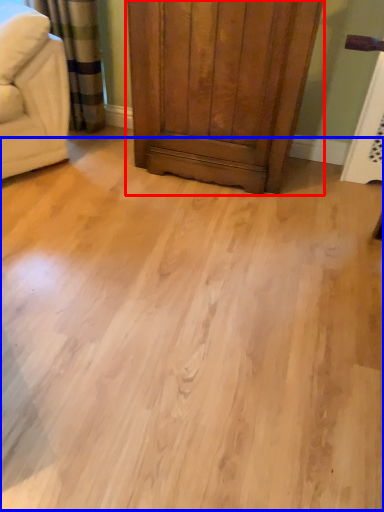
Question: Which object appears closest to the camera in this image, dresser (highlighted by a red box) or plain (highlighted by a blue box)?

Choices:
 (A) dresser
 (B) plain

Answer: (B)